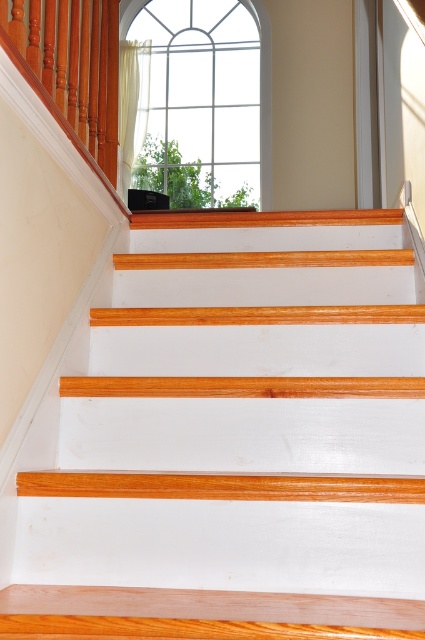
Question: Which of the following is the closest to the observer?

Choices:
 (A) clear glass window at upper center
 (B) polished wood handrail at upper left
 (C) white painted wood stair at center

Answer: (C)

Question: Is white painted wood stair at center to the right of polished wood handrail at upper left from the viewer's perspective?

Choices:
 (A) no
 (B) yes

Answer: (B)

Question: Estimate the real-world distances between objects in this image. Which object is closer to the polished wood handrail at upper left?

Choices:
 (A) clear glass window at upper center
 (B) white painted wood stair at center

Answer: (B)

Question: Can you confirm if white painted wood stair at center is thinner than polished wood handrail at upper left?

Choices:
 (A) yes
 (B) no

Answer: (B)

Question: Based on their relative distances, which object is farther from the polished wood handrail at upper left?

Choices:
 (A) clear glass window at upper center
 (B) white painted wood stair at center

Answer: (A)

Question: Is white painted wood stair at center wider than clear glass window at upper center?

Choices:
 (A) yes
 (B) no

Answer: (B)